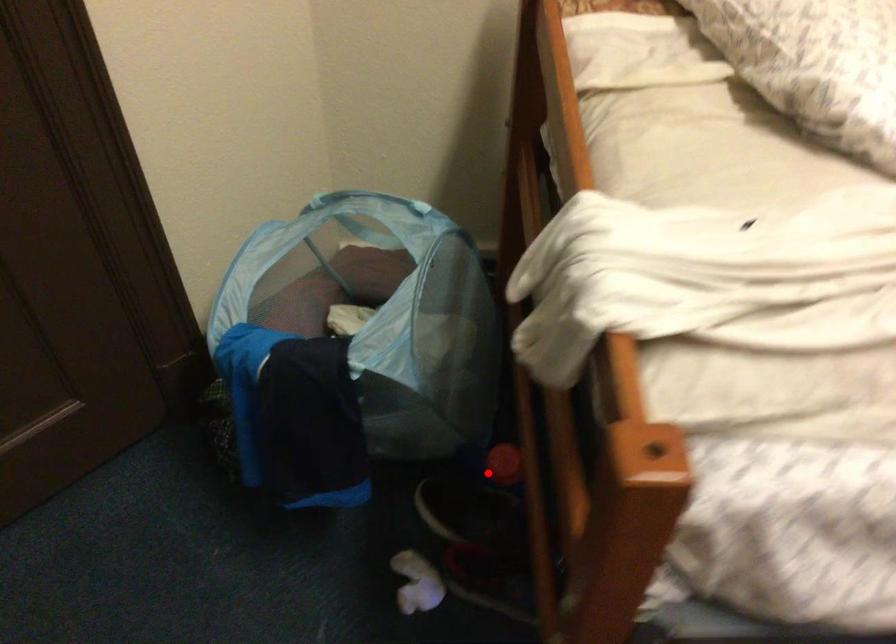
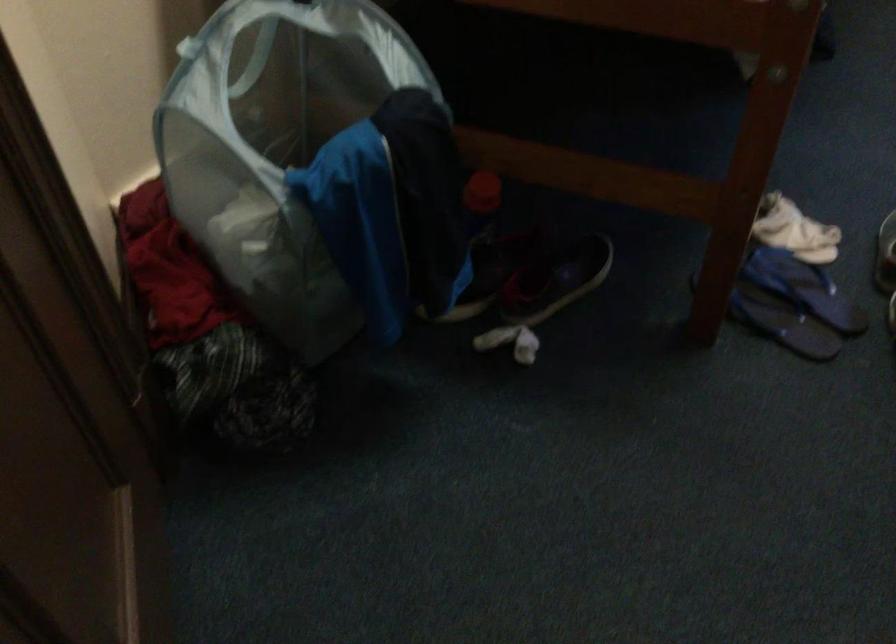
Find the pixel in the second image that matches the highlighted location in the first image.

(480, 202)